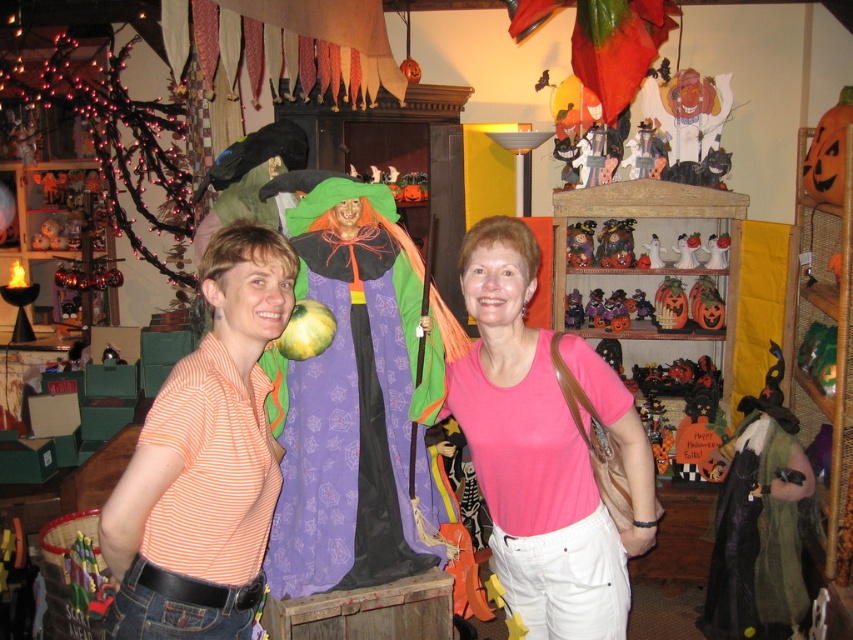
Does purple fabric witch at center appear under pink cotton shirt at center?

No.

Can you confirm if purple fabric witch at center is wider than pink cotton shirt at center?

No.

Consider the image. Measure the distance between purple fabric witch at center and camera.

purple fabric witch at center is 1.89 meters away from camera.

Find the location of a particular element. The image size is (853, 640). purple fabric witch at center is located at coordinates (358, 401).

Which is below, purple fabric witch at center or matte plastic pumpkin at center?

→ purple fabric witch at center is lower down.

Is point (300, 376) positioned before point (587, 236)?

Yes, point (300, 376) is in front of point (587, 236).

Who is more forward, [334,244] or [575,244]?

Positioned in front is point [334,244].

Locate an element on the screen. This screenshot has height=640, width=853. purple fabric witch at center is located at coordinates (358, 401).

Is point (537, 385) positioned in front of point (125, 528)?

No, it is not.

Can you confirm if pink cotton shirt at center is smaller than orange striped shirt at center?

No, pink cotton shirt at center is not smaller than orange striped shirt at center.

Describe the element at coordinates (544, 449) in the screenshot. I see `pink cotton shirt at center` at that location.

Find the location of a particular element. pink cotton shirt at center is located at coordinates (544, 449).